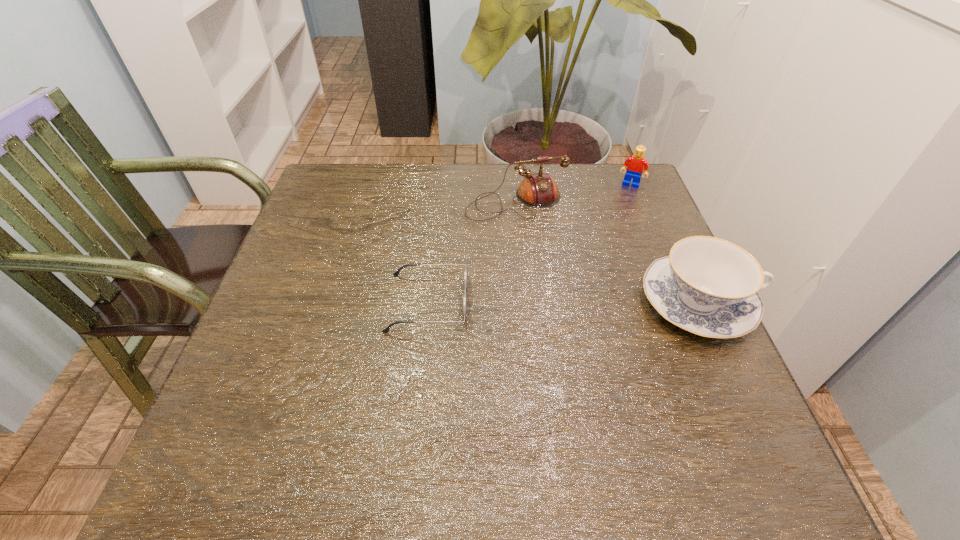
Where is `blank space located on the front-facing side of the Lego`? This screenshot has height=540, width=960. blank space located on the front-facing side of the Lego is located at coordinates (595, 276).

Locate an element on the screen. telephone located in the far edge section of the desktop is located at coordinates (538, 190).

The image size is (960, 540). What are the coordinates of `Lego at the far edge` in the screenshot? It's located at (636, 164).

Locate an element on the screen. This screenshot has width=960, height=540. chinaware at the right edge is located at coordinates (708, 286).

Where is `Lego that is positioned at the right edge`? Lego that is positioned at the right edge is located at coordinates (636, 164).

The height and width of the screenshot is (540, 960). What are the coordinates of `object that is at the far right corner` in the screenshot? It's located at (636, 164).

In the image, there is a desktop. At what (x,y) coordinates should I click in order to perform the action: click on vacant space at the far edge. Please return your answer as a coordinate pair (x, y). The image size is (960, 540). Looking at the image, I should click on (394, 207).

The image size is (960, 540). In order to click on vacant space at the near edge of the desktop in this screenshot , I will do `click(381, 413)`.

In the image, there is a desktop. Identify the location of vacant area at the left edge. This screenshot has width=960, height=540. (358, 231).

The width and height of the screenshot is (960, 540). I want to click on vacant point at the right edge, so click(640, 278).